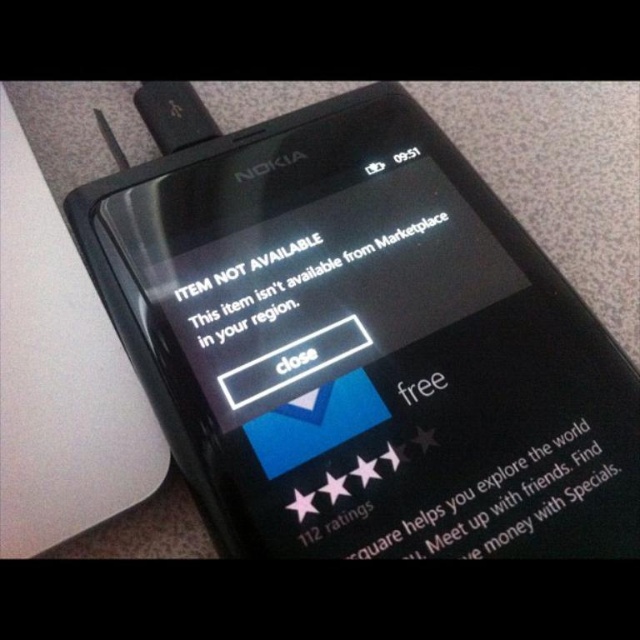
Consider the image. You are using a classic Nokia smartphone from the early 2010s. You see two points on the screen at coordinates point (371,212) and point (429,225). Which point is closer to you?

Point (371,212) is further to the viewer than point (429,225), so the point closer to you is point (429,225).

You are trying to click the close button on the Nokia smartphone screen. The coordinates of the close button are at point (358, 340). Based on the image description, where should you tap to close the notification?

The point (358, 340) corresponds to the black glossy smartphone at center, so you should tap the center of the smartphone screen to close the notification.